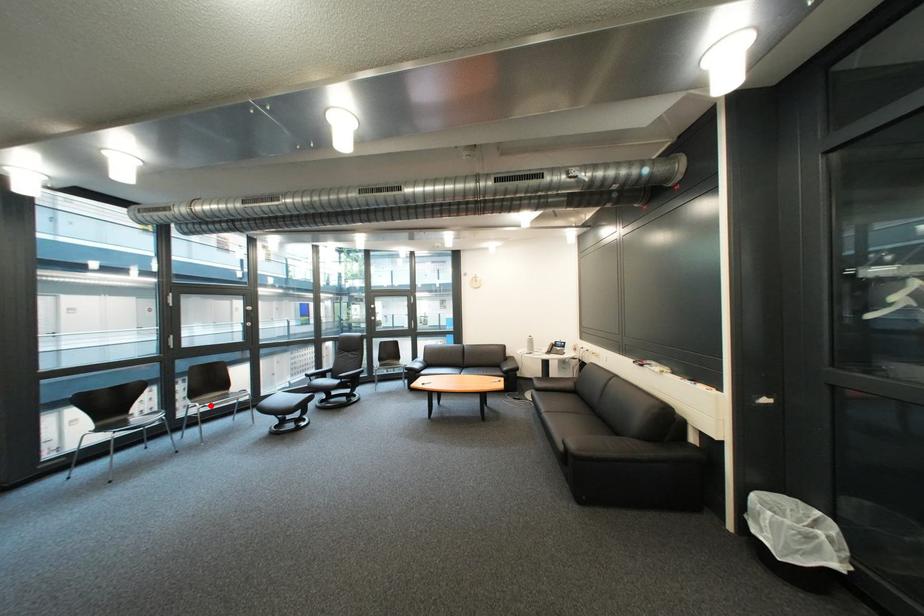
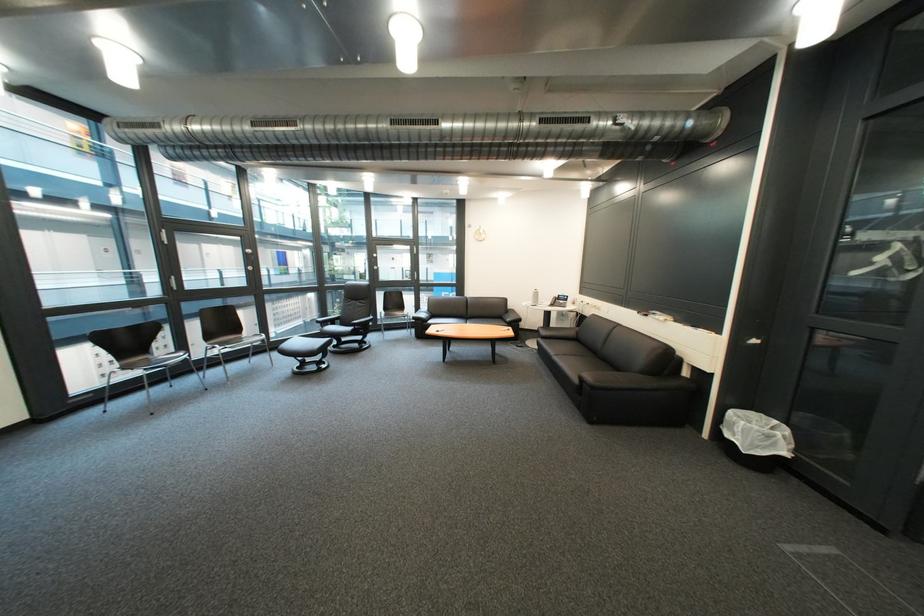
Locate, in the second image, the point that corresponds to the highlighted location in the first image.

(229, 347)